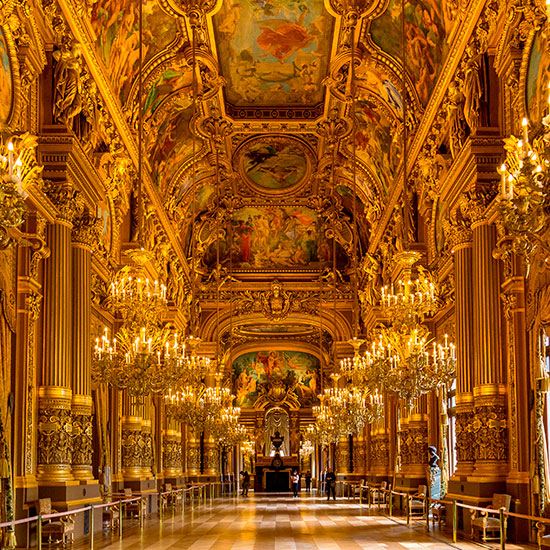
Where is `statue`? statue is located at coordinates (434, 458).